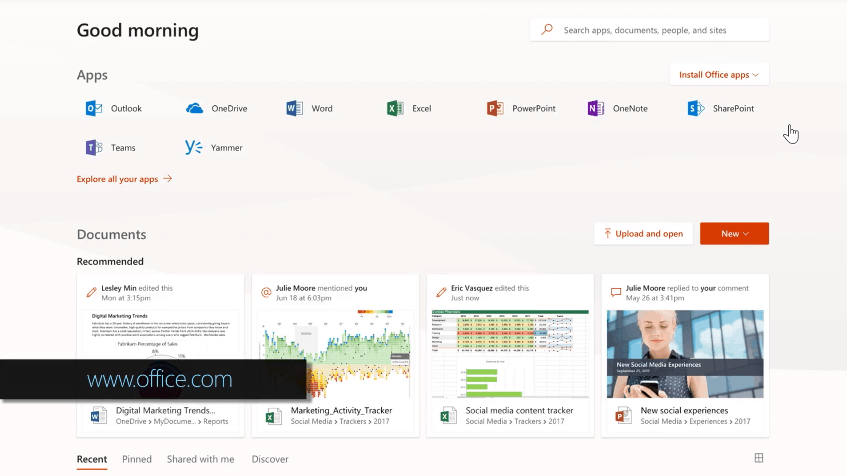
Where is `window in image`? This screenshot has width=847, height=476. window in image is located at coordinates (694, 338).